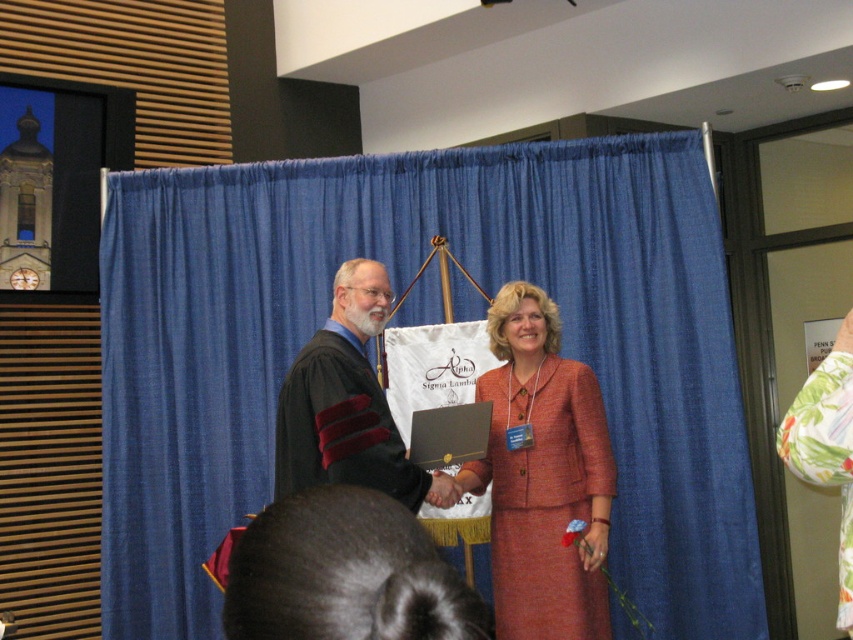
You are attending a formal event and notice the blue fabric curtain at center. Where is it located in the image?

The blue fabric curtain at center is located at point (397,292) in the image.

You are an event photographer at the back of the room. You need to capture a clear photo of both the orange woolen suit at center and the matte black robe at center. Based on their positions, which one should you focus on first to ensure both are in frame?

The matte black robe at center is behind the orange woolen suit at center, so you should focus on the orange woolen suit at center first to ensure both are in frame without obstruction.